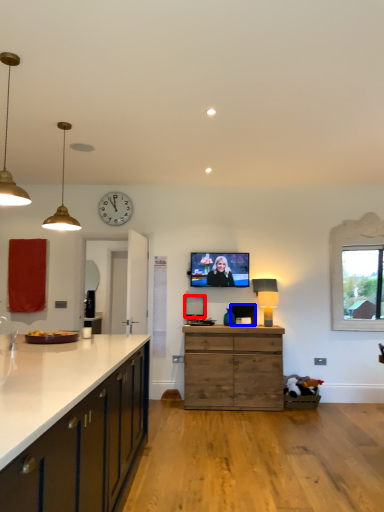
Question: Which of the following is the closest to the observer, picture frame (highlighted by a red box) or picture frame (highlighted by a blue box)?

Choices:
 (A) picture frame
 (B) picture frame

Answer: (B)